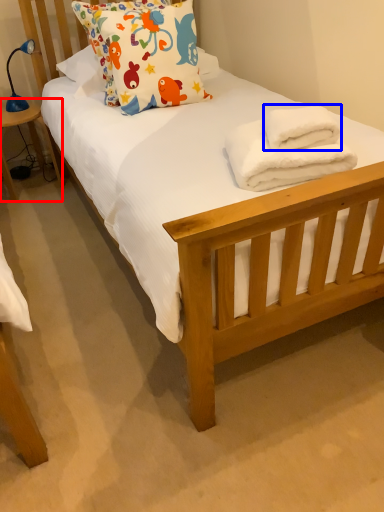
Question: Which object appears farthest to the camera in this image, table (highlighted by a red box) or bath towel (highlighted by a blue box)?

Choices:
 (A) table
 (B) bath towel

Answer: (A)